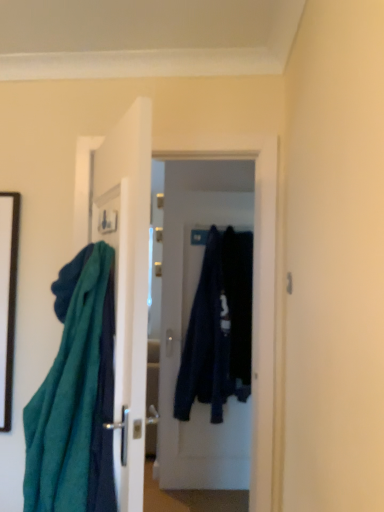
Find the location of `black matte picture frame at left`. black matte picture frame at left is located at coordinates (7, 298).

Describe the element at coordinates (127, 284) in the screenshot. This screenshot has height=512, width=384. I see `white glossy door at center, the 1th door from the left` at that location.

Locate an element on the screen. This screenshot has width=384, height=512. dark blue fabric at center, positioned as the 1th door in back-to-front order is located at coordinates (188, 323).

How different are the orientations of dark blue fabric at center, which appears as the second clothing when viewed from the left, and white glossy door at center, acting as the second door starting from the right, in degrees?

There is a 75-degree angle between the facing directions of dark blue fabric at center, which appears as the second clothing when viewed from the left, and white glossy door at center, acting as the second door starting from the right.

Which of these two, dark blue fabric at center, which ranks as the first clothing in right-to-left order, or white glossy door at center, the first door from the front, stands taller?

white glossy door at center, the first door from the front.

Looking at this image, from a real-world perspective, who is located lower, dark blue fabric at center, which ranks as the first clothing in right-to-left order, or white glossy door at center, the 1th door from the left?

white glossy door at center, the 1th door from the left, from a real-world perspective.

Consider the image. From the image's perspective, is dark blue fabric at center, which ranks as the first clothing in right-to-left order, located beneath white glossy door at center, the 1th door from the left?

Correct, dark blue fabric at center, which ranks as the first clothing in right-to-left order, appears lower than white glossy door at center, the 1th door from the left, in the image.

Looking at the image, does dark blue fabric at center, which is counted as the 2th clothing, starting from the right, seem bigger or smaller compared to white glossy door at center, the 1th door from the left?

Clearly, dark blue fabric at center, which is counted as the 2th clothing, starting from the right, is smaller in size than white glossy door at center, the 1th door from the left.

From a real-world perspective, does dark blue fabric at center, which is counted as the 2th clothing, starting from the right, sit lower than white glossy door at center, the 2th door positioned from the back?

Yes, from a real-world perspective, dark blue fabric at center, which is counted as the 2th clothing, starting from the right, is below white glossy door at center, the 2th door positioned from the back.

How different are the orientations of dark blue fabric at center, which is counted as the 2th clothing, starting from the right, and white glossy door at center, the 2th door positioned from the back, in degrees?

75 degrees separate the facing orientations of dark blue fabric at center, which is counted as the 2th clothing, starting from the right, and white glossy door at center, the 2th door positioned from the back.

Who is taller, dark blue fabric at center, which appears as the 1th clothing when viewed from the left, or white glossy door at center, the 2th door positioned from the back?

white glossy door at center, the 2th door positioned from the back, is taller.

Based on the photo, would you say dark blue fabric at center, which ranks as the first clothing in right-to-left order, is part of dark blue fabric at center, which is counted as the 2th clothing, starting from the right,'s contents?

That's incorrect, dark blue fabric at center, which ranks as the first clothing in right-to-left order, is not inside dark blue fabric at center, which is counted as the 2th clothing, starting from the right.

Is there a large distance between dark blue fabric at center, which is counted as the 2th clothing, starting from the right, and dark blue fabric at center, which ranks as the first clothing in right-to-left order?

No.

Is point (235, 243) closer or farther from the camera than point (227, 284)?

Clearly, point (235, 243) is more distant from the camera than point (227, 284).

Is dark blue fabric at center, positioned as the 1th door in back-to-front order, located within teal fabric at left?

No.

Does teal fabric at left have a lesser height compared to dark blue fabric at center, positioned as the 1th door in back-to-front order?

Yes, teal fabric at left is shorter than dark blue fabric at center, positioned as the 1th door in back-to-front order.

Can you confirm if teal fabric at left is thinner than dark blue fabric at center, marked as the first door in a right-to-left arrangement?

In fact, teal fabric at left might be wider than dark blue fabric at center, marked as the first door in a right-to-left arrangement.

Is teal fabric at left far away from dark blue fabric at center, placed as the 2th door when sorted from left to right?

Yes.

Between white glossy door at center, the first door from the front, and dark blue fabric at center, placed as the 2th door when sorted from left to right, which one is positioned behind?

Positioned behind is dark blue fabric at center, placed as the 2th door when sorted from left to right.

Which object is positioned more to the right, white glossy door at center, acting as the second door starting from the right, or dark blue fabric at center, placed as the 2th door when sorted from left to right?

dark blue fabric at center, placed as the 2th door when sorted from left to right.

Is white glossy door at center, the first door from the front, outside of dark blue fabric at center, marked as the first door in a right-to-left arrangement?

Yes, white glossy door at center, the first door from the front, is outside of dark blue fabric at center, marked as the first door in a right-to-left arrangement.

Is black matte picture frame at left facing towards dark blue fabric at center, positioned as the 1th door in back-to-front order?

No, black matte picture frame at left is not oriented towards dark blue fabric at center, positioned as the 1th door in back-to-front order.

Based on the photo, which object is more forward, black matte picture frame at left or dark blue fabric at center, positioned as the 1th door in back-to-front order?

black matte picture frame at left is more forward.

From a real-world perspective, is black matte picture frame at left physically located above or below dark blue fabric at center, placed as the 2th door when sorted from left to right?

In terms of real-world spatial position, black matte picture frame at left is above dark blue fabric at center, placed as the 2th door when sorted from left to right.

In terms of height, does black matte picture frame at left look taller or shorter compared to dark blue fabric at center, placed as the 2th door when sorted from left to right?

Clearly, black matte picture frame at left is shorter compared to dark blue fabric at center, placed as the 2th door when sorted from left to right.

Find the location of a particular element. the 1st clothing above the teal fabric at left (from the image's perspective) is located at coordinates (219, 327).

Can you tell me how much dark blue fabric at center, which is counted as the 2th clothing, starting from the right, and teal fabric at left differ in facing direction?

The angle between the facing direction of dark blue fabric at center, which is counted as the 2th clothing, starting from the right, and the facing direction of teal fabric at left is 75 degrees.

Considering the relative sizes of dark blue fabric at center, which is counted as the 2th clothing, starting from the right, and teal fabric at left in the image provided, is dark blue fabric at center, which is counted as the 2th clothing, starting from the right, taller than teal fabric at left?

Correct, dark blue fabric at center, which is counted as the 2th clothing, starting from the right, is much taller as teal fabric at left.

Which door is the 2nd one when counting from the left side of the dark blue fabric at center, which appears as the second clothing when viewed from the left? Please provide its 2D coordinates.

[(127, 284)]

Find the location of a particular element. the 2nd clothing behind the white glossy door at center, the 1th door from the left, counting from the anchor's position is located at coordinates (219, 327).

When comparing their distances from black matte picture frame at left, does dark blue fabric at center, which is counted as the 2th clothing, starting from the right, or dark blue fabric at center, which appears as the second clothing when viewed from the left, seem further?

dark blue fabric at center, which appears as the second clothing when viewed from the left, lies further to black matte picture frame at left than the other object.

From the image, which object appears to be farther from teal fabric at left, white glossy door at center, acting as the second door starting from the right, or dark blue fabric at center, marked as the first door in a right-to-left arrangement?

Based on the image, dark blue fabric at center, marked as the first door in a right-to-left arrangement, appears to be further to teal fabric at left.

Which object lies further to the anchor point teal fabric at left, dark blue fabric at center, which appears as the second clothing when viewed from the left, or black matte picture frame at left?

The object further to teal fabric at left is dark blue fabric at center, which appears as the second clothing when viewed from the left.

Which object lies further to the anchor point white glossy door at center, the first door from the front, dark blue fabric at center, which appears as the second clothing when viewed from the left, or dark blue fabric at center, positioned as the 1th door in back-to-front order?

dark blue fabric at center, positioned as the 1th door in back-to-front order.

Looking at the image, which one is located further to white glossy door at center, acting as the second door starting from the right, dark blue fabric at center, marked as the first door in a right-to-left arrangement, or teal fabric at left?

dark blue fabric at center, marked as the first door in a right-to-left arrangement.

From the image, which object appears to be farther from black matte picture frame at left, dark blue fabric at center, which appears as the 1th clothing when viewed from the left, or white glossy door at center, the first door from the front?

dark blue fabric at center, which appears as the 1th clothing when viewed from the left, is further to black matte picture frame at left.

When comparing their distances from teal fabric at left, does dark blue fabric at center, which is counted as the 2th clothing, starting from the right, or black matte picture frame at left seem closer?

black matte picture frame at left.

Consider the image. From the image, which object appears to be farther from teal fabric at left, black matte picture frame at left or dark blue fabric at center, marked as the first door in a right-to-left arrangement?

Among the two, dark blue fabric at center, marked as the first door in a right-to-left arrangement, is located further to teal fabric at left.

In order to click on clothing between black matte picture frame at left and dark blue fabric at center, which ranks as the first clothing in right-to-left order, from left to right in this screenshot , I will do `click(219, 327)`.

The width and height of the screenshot is (384, 512). What are the coordinates of `picture frame located between teal fabric at left and dark blue fabric at center, which appears as the second clothing when viewed from the left, in the depth direction` in the screenshot? It's located at (7, 298).

Find the location of a particular element. This screenshot has width=384, height=512. door located between dark blue fabric at center, which is counted as the 2th clothing, starting from the right, and dark blue fabric at center, which appears as the second clothing when viewed from the left, in the left-right direction is located at coordinates (188, 323).

The image size is (384, 512). Find the location of `door between teal fabric at left and dark blue fabric at center, placed as the 2th door when sorted from left to right, along the z-axis`. door between teal fabric at left and dark blue fabric at center, placed as the 2th door when sorted from left to right, along the z-axis is located at coordinates (127, 284).